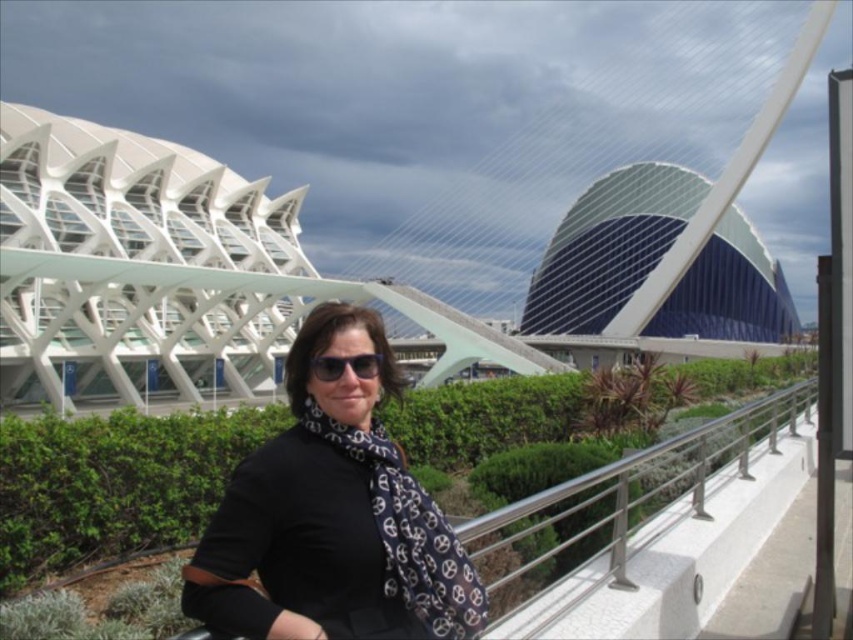
Question: Among these points, which one is farthest from the camera?

Choices:
 (A) (235, 628)
 (B) (350, 358)
 (C) (720, 436)

Answer: (C)

Question: Observing the image, what is the correct spatial positioning of black silk scarf at center in reference to metallic silver railing at center?

Choices:
 (A) right
 (B) left

Answer: (B)

Question: Which point appears closest to the camera in this image?

Choices:
 (A) (468, 544)
 (B) (329, 628)
 (C) (338, 369)

Answer: (B)

Question: Can you confirm if metallic silver railing at center is positioned to the right of black reflective sunglasses at center?

Choices:
 (A) no
 (B) yes

Answer: (B)

Question: Which point is closer to the camera?

Choices:
 (A) (641, 502)
 (B) (321, 317)

Answer: (B)

Question: Can you confirm if metallic silver railing at center is smaller than black reflective sunglasses at center?

Choices:
 (A) yes
 (B) no

Answer: (B)